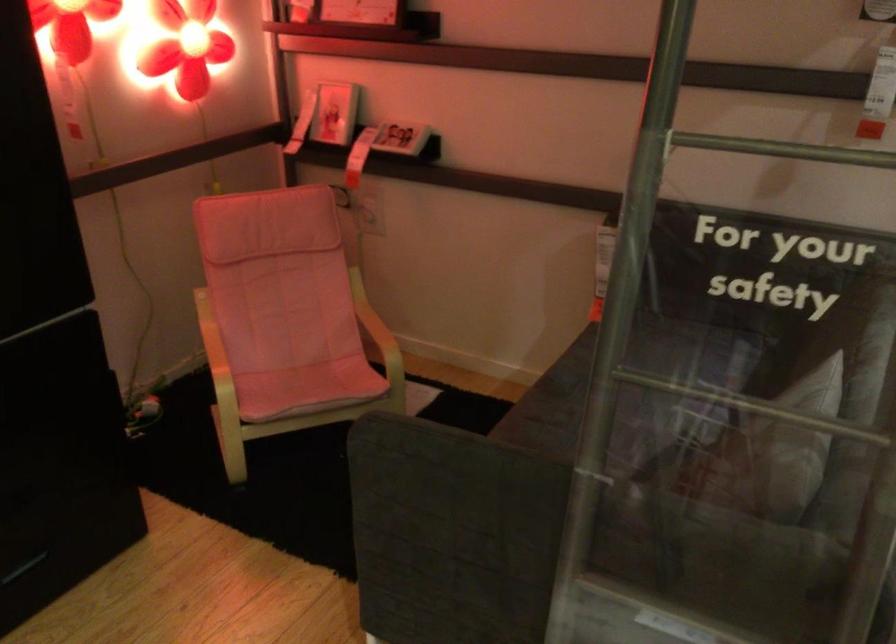
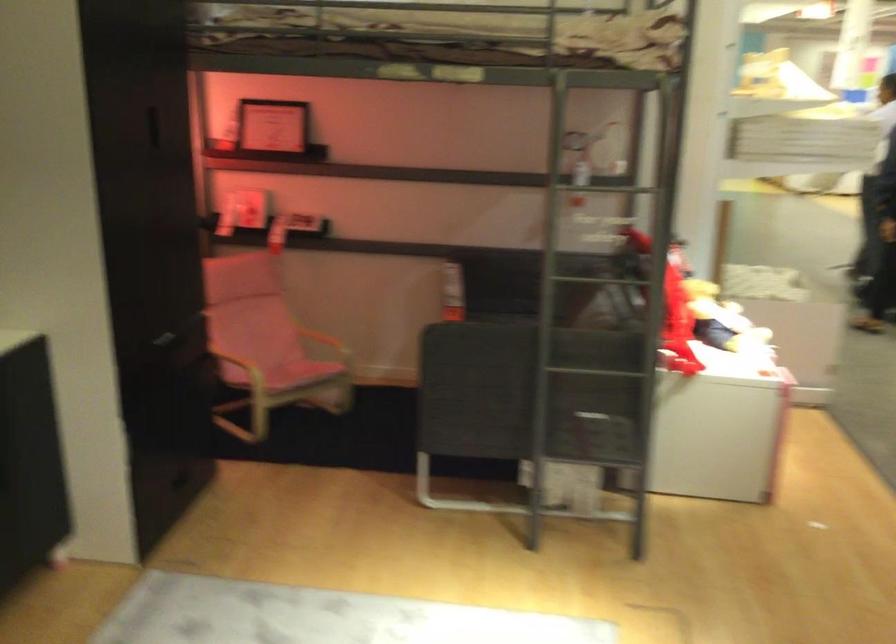
In the second image, find the point that corresponds to pixel 295 339 in the first image.

(268, 353)